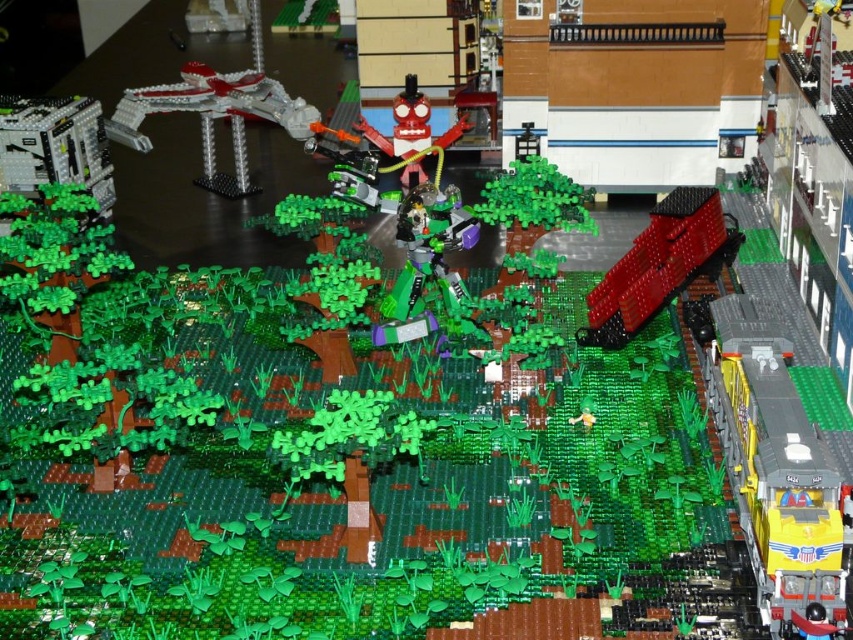
Question: Which object appears farthest from the camera in this image?

Choices:
 (A) black plastic clock at left
 (B) shiny metallic spaceship at upper left
 (C) shiny red train at center-right

Answer: (B)

Question: Among these points, which one is farthest from the camera?

Choices:
 (A) pyautogui.click(x=395, y=108)
 (B) pyautogui.click(x=587, y=307)
 (C) pyautogui.click(x=764, y=464)
 (D) pyautogui.click(x=204, y=168)

Answer: (D)

Question: Does black plastic clock at left have a greater width compared to green matte tree at center?

Choices:
 (A) no
 (B) yes

Answer: (B)

Question: Which object is positioned closest to the green matte tree at center?

Choices:
 (A) shiny metallic spaceship at upper left
 (B) yellow plastic truck at lower right
 (C) black plastic clock at left

Answer: (B)

Question: Can you confirm if green matte tree at center is bigger than matte red robot at center?

Choices:
 (A) yes
 (B) no

Answer: (B)

Question: Does translucent green plastic figure at center come behind green matte tree at center?

Choices:
 (A) no
 (B) yes

Answer: (A)